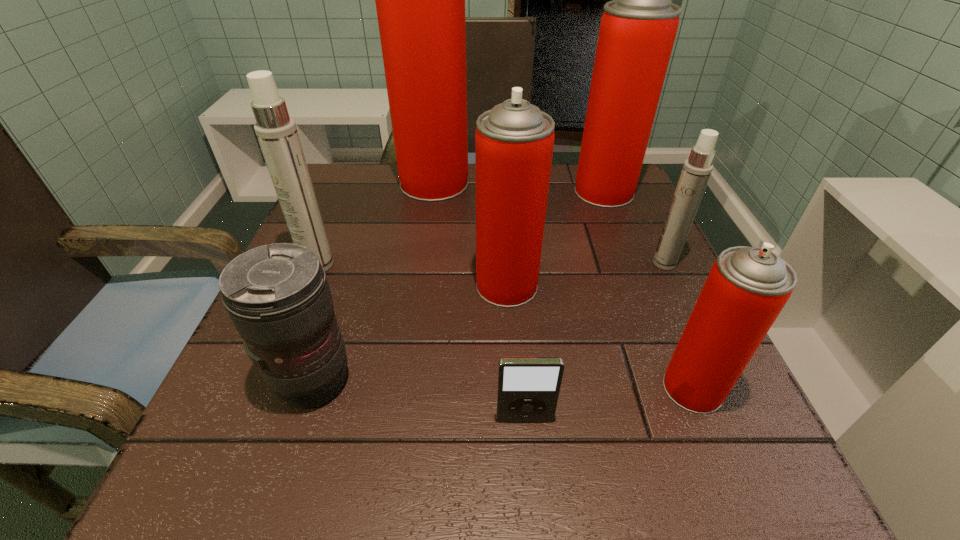
This screenshot has width=960, height=540. I want to click on object that is the second closest to the iPod, so click(514, 141).

Identify which aerosol can is the closest to the nearest red aerosol can. Please provide its 2D coordinates. Your answer should be formatted as a tuple, i.e. [(x, y)], where the tuple contains the x and y coordinates of a point satisfying the conditions above.

[(514, 141)]

Select which aerosol can appears as the fifth closest to the seventh shortest object. Please provide its 2D coordinates. Your answer should be formatted as a tuple, i.e. [(x, y)], where the tuple contains the x and y coordinates of a point satisfying the conditions above.

[(277, 133)]

Identify the location of red aerosol can object that ranks as the third closest to the leftmost red aerosol can. (x=747, y=287).

Select which red aerosol can is the third closest to the leftmost aerosol can. Please provide its 2D coordinates. Your answer should be formatted as a tuple, i.e. [(x, y)], where the tuple contains the x and y coordinates of a point satisfying the conditions above.

[(637, 31)]

Identify the location of vacant space that satisfies the following two spatial constraints: 1. on the back side of the right white aerosol can; 2. on the right side of the nearest red aerosol can. Image resolution: width=960 pixels, height=540 pixels. (640, 263).

Locate an element on the screen. blank area in the image that satisfies the following two spatial constraints: 1. on the side of the seventh tallest object where the control switches are located; 2. on the left side of the nearest aerosol can is located at coordinates pos(312,388).

The width and height of the screenshot is (960, 540). I want to click on vacant space that satisfies the following two spatial constraints: 1. on the front side of the tallest aerosol can; 2. on the right side of the third aerosol can from left to right, so click(419, 286).